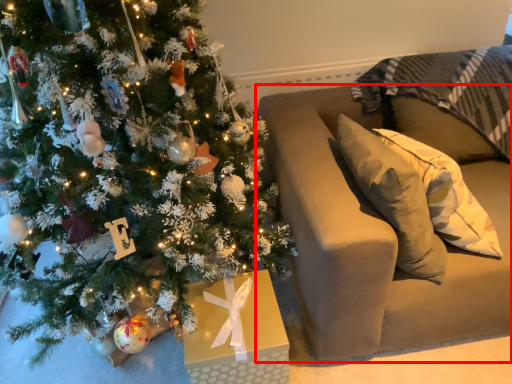
Question: From the image's perspective, considering the relative positions of furniture (annotated by the red box) and christmas tree in the image provided, where is furniture (annotated by the red box) located with respect to the staircase?

Choices:
 (A) below
 (B) above

Answer: (A)